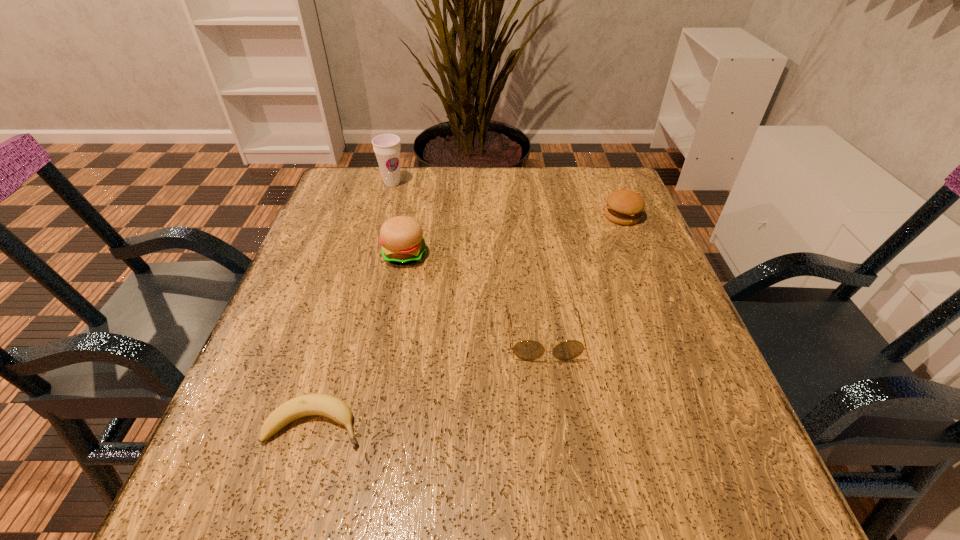
Where is `free location that satisfies the following two spatial constraints: 1. on the front side of the cup; 2. on the left side of the right hamburger`? The height and width of the screenshot is (540, 960). free location that satisfies the following two spatial constraints: 1. on the front side of the cup; 2. on the left side of the right hamburger is located at coordinates (384, 216).

Where is `free region that satisfies the following two spatial constraints: 1. on the lenses of the sunglasses; 2. at the stem of the shortest object`? This screenshot has width=960, height=540. free region that satisfies the following two spatial constraints: 1. on the lenses of the sunglasses; 2. at the stem of the shortest object is located at coordinates (556, 425).

This screenshot has width=960, height=540. I want to click on blank space that satisfies the following two spatial constraints: 1. on the front side of the farthest object; 2. at the stem of the shortest object, so click(326, 425).